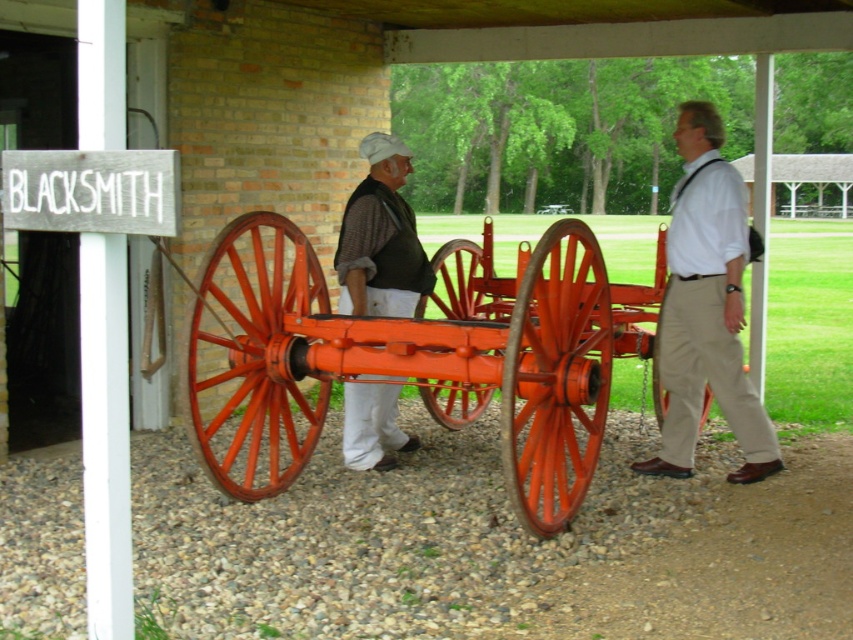
You are a visitor at a historical reenactment and want to take a photo of the orange polished wood cart at center and the matte white shirt at right. Your camera has a maximum focus range of 1.5 meters. Can you capture both objects in focus without moving your position?

The orange polished wood cart at center is 1.32 meters away from the matte white shirt at right. Since the distance between them is within the camera maximum focus range of 1.5 meters, you can capture both objects in focus without moving your position.

You are standing at the point closest to you in the image. Which point, point (659, 422) or point (396, 282), is farther away from you?

Point (659, 422) is behind point (396, 282), so it is farther away from you.

You are standing at the center of the gravel surface in front of the bright orange wooden cart. You need to locate the matte white shirt at right. In which direction should you look relative to the cart?

The matte white shirt at right is located to the right side of the cart.